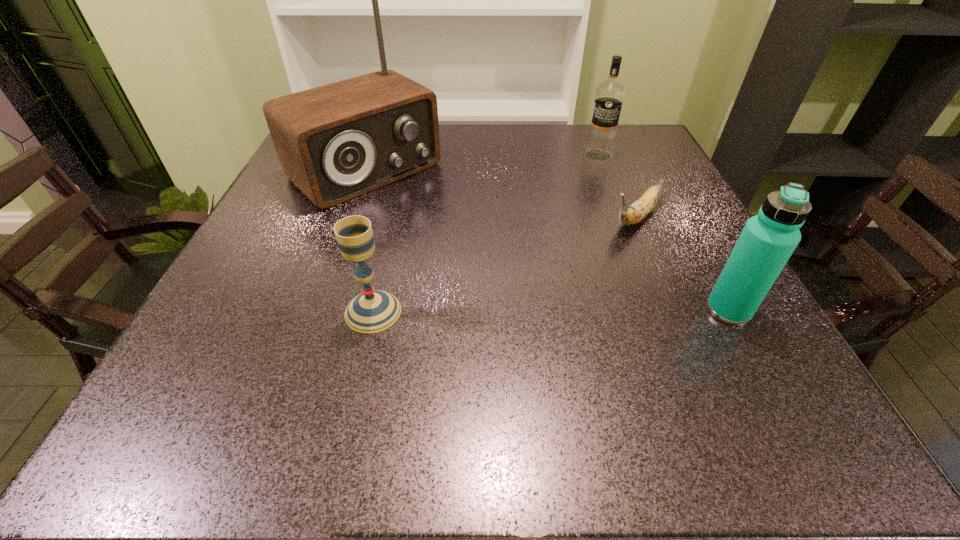
Image resolution: width=960 pixels, height=540 pixels. I want to click on free spot between the shortest object and the vodka, so click(616, 186).

Locate an element on the screen. The width and height of the screenshot is (960, 540). the second closest object to the shortest object is located at coordinates (767, 241).

Select which object appears as the third closest to the vodka. Please provide its 2D coordinates. Your answer should be formatted as a tuple, i.e. [(x, y)], where the tuple contains the x and y coordinates of a point satisfying the conditions above.

[(767, 241)]

Where is `free spot that satisfies the following two spatial constraints: 1. on the back side of the shortest object; 2. on the right side of the chalice`? free spot that satisfies the following two spatial constraints: 1. on the back side of the shortest object; 2. on the right side of the chalice is located at coordinates (395, 217).

Where is `free spot that satisfies the following two spatial constraints: 1. on the front side of the tallest object; 2. on the right side of the banana`? free spot that satisfies the following two spatial constraints: 1. on the front side of the tallest object; 2. on the right side of the banana is located at coordinates (348, 217).

The height and width of the screenshot is (540, 960). Identify the location of free spot that satisfies the following two spatial constraints: 1. on the back side of the banana; 2. on the left side of the fourth tallest object. (395, 217).